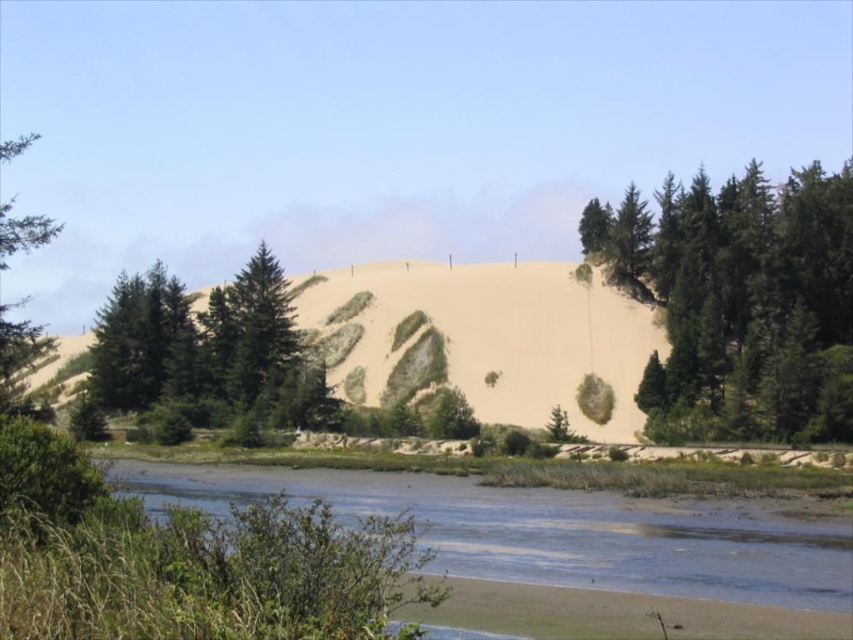
You are standing at the base of the large sand dune in the center of the image and see two points marked on the dune surface. The first point is labeled as point (x=363, y=369) and the second is point (x=15, y=337). If you were to walk towards the first point, would you be moving closer to or further away from the camera compared to walking towards the second point?

Point (x=363, y=369) is further to the camera than point (x=15, y=337). Therefore, walking towards the first point would mean moving closer to the camera, while walking towards the second point would take you further away from the camera.

You are planning to build a small cabin on the brown sandy river at lower center and the sandy beige hillside at center. Which location would provide more space for the cabin?

The sandy beige hillside at center is larger than the brown sandy river at lower center, so it would provide more space for the cabin.